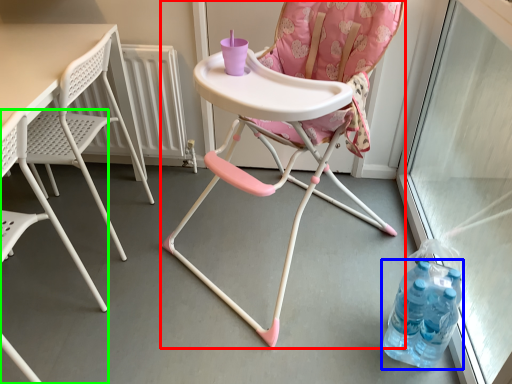
Question: Considering the real-world distances, which object is farthest from chair (highlighted by a red box)? bottle (highlighted by a blue box) or chair (highlighted by a green box)?

Choices:
 (A) bottle
 (B) chair

Answer: (B)